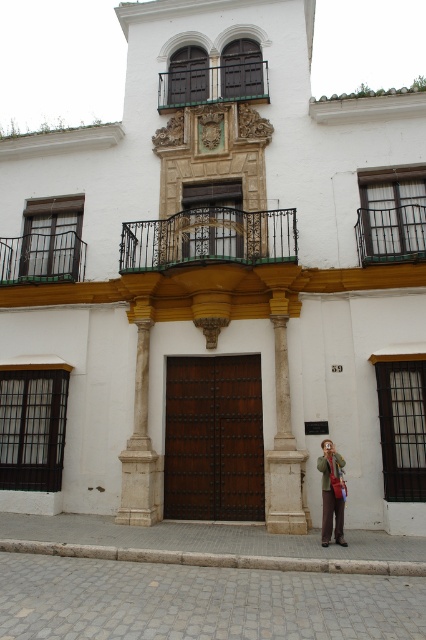
Question: Which point is closer to the camera?

Choices:
 (A) (141, 349)
 (B) (282, 497)
 (C) (31, 269)
 (D) (265, 227)

Answer: (B)

Question: Considering the relative positions of white marble column at center and green glass balcony at upper left in the image provided, where is white marble column at center located with respect to green glass balcony at upper left?

Choices:
 (A) below
 (B) above

Answer: (A)

Question: Which of the following is the closest to the observer?

Choices:
 (A) (173, 76)
 (B) (25, 262)
 (C) (204, 220)
 (D) (143, 506)

Answer: (D)

Question: Is green wrought iron balcony at center further to camera compared to white marble column at center?

Choices:
 (A) yes
 (B) no

Answer: (A)

Question: Which of the following is the closest to the observer?

Choices:
 (A) (405, 240)
 (B) (134, 460)

Answer: (B)

Question: Is white marble column at center to the left of green fabric jacket at lower right from the viewer's perspective?

Choices:
 (A) no
 (B) yes

Answer: (B)